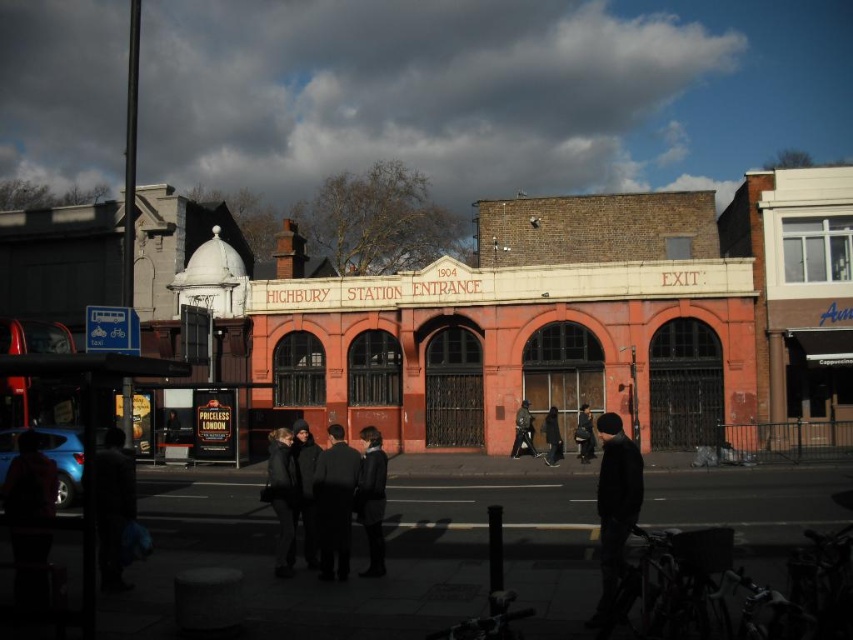
Question: Can you confirm if black leather coat at center is thinner than dark gray wool coat at center?

Choices:
 (A) no
 (B) yes

Answer: (B)

Question: Based on their relative distances, which object is nearer to the dark gray fabric jacket at center?

Choices:
 (A) metallic blue bus stop at lower left
 (B) dark gray wool coat at center
 (C) dark gray fabric coat at center
 (D) dark gray coat at center

Answer: (D)

Question: Does dark gray coat at lower left appear on the left side of dark gray wool coat at center?

Choices:
 (A) no
 (B) yes

Answer: (B)

Question: Observing the image, what is the correct spatial positioning of dark gray fabric coat at center in reference to dark gray coat at center?

Choices:
 (A) above
 (B) below

Answer: (B)

Question: Based on their relative distances, which object is nearer to the black leather coat at center?

Choices:
 (A) dark gray jacket at center
 (B) dark wool coat at center
 (C) dark gray fabric coat at center
 (D) dark gray coat at lower left

Answer: (B)

Question: Which object is farther from the camera taking this photo?

Choices:
 (A) dark gray fabric jacket at center
 (B) dark wool coat at center
 (C) dark gray wool coat at center

Answer: (A)